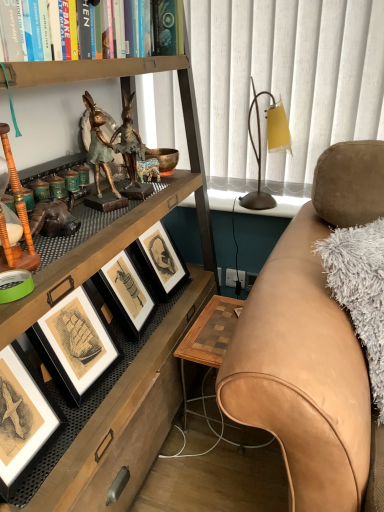
Question: From a real-world perspective, is tan leather couch at right positioned above or below hardcover book at upper left?

Choices:
 (A) below
 (B) above

Answer: (A)

Question: Considering the positions of tan leather couch at right and hardcover book at upper left in the image, is tan leather couch at right bigger or smaller than hardcover book at upper left?

Choices:
 (A) big
 (B) small

Answer: (A)

Question: Based on their relative distances, which object is farther from the tan leather couch at right?

Choices:
 (A) hardcover book at upper left
 (B) wooden checkered table at lower right
 (C) bronze statue at upper left
 (D) translucent glass lampshade at upper right
 (E) matte black picture frame at lower left

Answer: (A)

Question: Which object is the closest to the tan leather couch at right?

Choices:
 (A) matte black picture frame at lower left
 (B) hardcover book at upper left
 (C) wooden checkered table at lower right
 (D) translucent glass lampshade at upper right
 (E) bronze statue at upper left

Answer: (C)